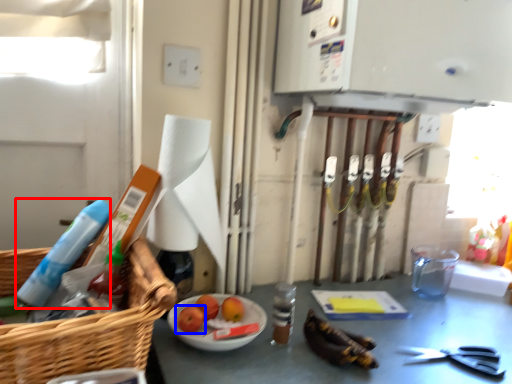
Question: Which point is closer to the camera, cleaning product (highlighted by a red box) or fruit (highlighted by a blue box)?

Choices:
 (A) cleaning product
 (B) fruit

Answer: (A)